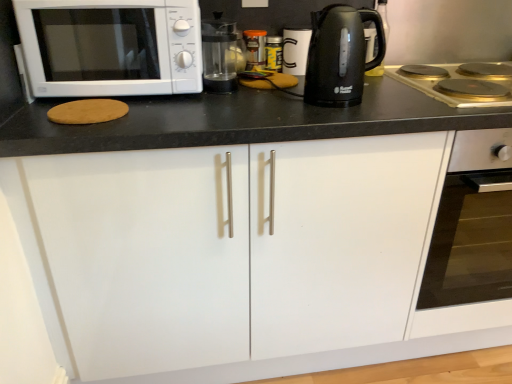
Question: Is gold-coated stovetop at right inside transparent glass coffee machine at center?

Choices:
 (A) no
 (B) yes

Answer: (A)

Question: Can you see transparent glass coffee machine at center touching gold-coated stovetop at right?

Choices:
 (A) yes
 (B) no

Answer: (B)

Question: Is transparent glass coffee machine at center outside of gold-coated stovetop at right?

Choices:
 (A) yes
 (B) no

Answer: (A)

Question: Is transparent glass coffee machine at center positioned far away from gold-coated stovetop at right?

Choices:
 (A) no
 (B) yes

Answer: (A)

Question: Does transparent glass coffee machine at center lie behind gold-coated stovetop at right?

Choices:
 (A) no
 (B) yes

Answer: (B)

Question: Looking at their shapes, would you say gold-coated stovetop at right is wider or thinner than transparent glass coffee machine at center?

Choices:
 (A) wide
 (B) thin

Answer: (A)

Question: Considering the positions of point (452, 99) and point (229, 31), is point (452, 99) closer or farther from the camera than point (229, 31)?

Choices:
 (A) farther
 (B) closer

Answer: (B)

Question: From a real-world perspective, is gold-coated stovetop at right physically located above or below transparent glass coffee machine at center?

Choices:
 (A) above
 (B) below

Answer: (B)

Question: From the image's perspective, is gold-coated stovetop at right located above or below transparent glass coffee machine at center?

Choices:
 (A) below
 (B) above

Answer: (A)

Question: Is transparent glass coffee machine at center to the left or to the right of white ceramic mug at upper center, which ranks as the 2th appliance in left-to-right order, in the image?

Choices:
 (A) left
 (B) right

Answer: (A)

Question: Considering the positions of transparent glass coffee machine at center and white ceramic mug at upper center, which ranks as the 2th appliance in left-to-right order, in the image, is transparent glass coffee machine at center wider or thinner than white ceramic mug at upper center, which ranks as the 2th appliance in left-to-right order,?

Choices:
 (A) wide
 (B) thin

Answer: (B)

Question: Looking at the image, does transparent glass coffee machine at center seem bigger or smaller compared to white ceramic mug at upper center, the 1th appliance from the right?

Choices:
 (A) small
 (B) big

Answer: (B)

Question: From a real-world perspective, is transparent glass coffee machine at center positioned above or below white ceramic mug at upper center, the 1th appliance from the right?

Choices:
 (A) above
 (B) below

Answer: (A)

Question: Based on their positions, is metallic silver canister at center, the 2th appliance in the right-to-left sequence, located to the left or right of transparent glass coffee machine at center?

Choices:
 (A) left
 (B) right

Answer: (B)

Question: Is metallic silver canister at center, the 2th appliance in the right-to-left sequence, taller or shorter than transparent glass coffee machine at center?

Choices:
 (A) tall
 (B) short

Answer: (B)